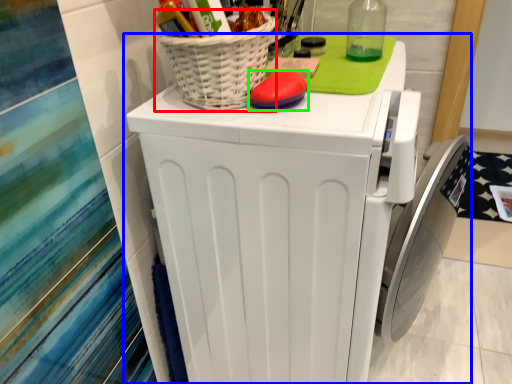
Question: Estimate the real-world distances between objects in this image. Which object is closer to basket (highlighted by a red box), home appliance (highlighted by a blue box) or soap (highlighted by a green box)?

Choices:
 (A) home appliance
 (B) soap

Answer: (B)